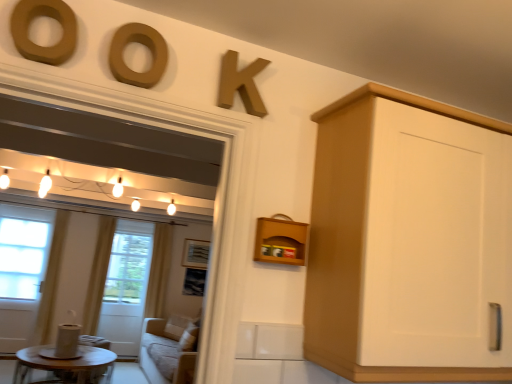
Describe the element at coordinates (126, 286) in the screenshot. I see `white glass screen door at left` at that location.

This screenshot has width=512, height=384. What do you see at coordinates (196, 253) in the screenshot? I see `wooden picture frame at center` at bounding box center [196, 253].

Image resolution: width=512 pixels, height=384 pixels. What are the coordinates of `wooden picture frame at center` in the screenshot? It's located at (196, 253).

Locate an element on the screen. The image size is (512, 384). wooden shelf at center is located at coordinates (280, 241).

What do you see at coordinates (50, 279) in the screenshot? Image resolution: width=512 pixels, height=384 pixels. I see `white fabric curtain at left, acting as the 3th curtain starting from the right` at bounding box center [50, 279].

This screenshot has height=384, width=512. I want to click on white matte cabinet at right, so click(410, 242).

In the scene shown: How different are the orientations of white matte cabinet at right and wooden round table at lower left in degrees?

The facing directions of white matte cabinet at right and wooden round table at lower left are 0.341 degrees apart.

Does white matte cabinet at right have a lesser width compared to wooden round table at lower left?

Indeed, white matte cabinet at right has a lesser width compared to wooden round table at lower left.

In the image, is white matte cabinet at right positioned in front of or behind wooden round table at lower left?

Clearly, white matte cabinet at right is in front of wooden round table at lower left.

Is white matte cabinet at right facing away from wooden round table at lower left?

Yes, white matte cabinet at right is facing away from wooden round table at lower left.

In the scene shown: Is matte gold letter k at upper center to the left or to the right of wooden picture frame at center in the image?

From the image, it's evident that matte gold letter k at upper center is to the right of wooden picture frame at center.

Is matte gold letter k at upper center oriented away from wooden picture frame at center?

Yes, matte gold letter k at upper center is facing away from wooden picture frame at center.

What's the angular difference between matte gold letter k at upper center and wooden picture frame at center's facing directions?

The angular difference between matte gold letter k at upper center and wooden picture frame at center is 1.93 degrees.

From the image's perspective, is matte gold letter k at upper center beneath wooden picture frame at center?

No, from the image's perspective, matte gold letter k at upper center is not below wooden picture frame at center.

From the image's perspective, is white sheer curtain at left, which is the 2th curtain in left-to-right order, beneath yellow fabric curtain at left, the first curtain positioned from the right?

Actually, white sheer curtain at left, which is the 2th curtain in left-to-right order, appears above yellow fabric curtain at left, the first curtain positioned from the right, in the image.

Is point (111, 228) positioned in front of point (170, 229)?

That is True.

Does white sheer curtain at left, which is the 2th curtain in left-to-right order, have a larger size compared to yellow fabric curtain at left, the first curtain positioned from the right?

Incorrect, white sheer curtain at left, which is the 2th curtain in left-to-right order, is not larger than yellow fabric curtain at left, the first curtain positioned from the right.

Choose the correct answer: Is white sheer curtain at left, the second curtain positioned from the right, inside yellow fabric curtain at left, the first curtain positioned from the right, or outside it?

white sheer curtain at left, the second curtain positioned from the right, is not inside yellow fabric curtain at left, the first curtain positioned from the right, it's outside.

In the scene shown: Does white wood door at left have a lesser width compared to matte gold letter k at upper center?

No, white wood door at left is not thinner than matte gold letter k at upper center.

How different are the orientations of white wood door at left and matte gold letter k at upper center in degrees?

There is a 1.56-degree angle between the facing directions of white wood door at left and matte gold letter k at upper center.

Is white wood door at left positioned far away from matte gold letter k at upper center?

Yes.

Is white wood door at left completely or partially outside of matte gold letter k at upper center?

Yes, white wood door at left is outside of matte gold letter k at upper center.

Considering the points (199, 247) and (251, 70), which point is in front, point (199, 247) or point (251, 70)?

The point (251, 70) is closer to the camera.

Between wooden picture frame at center and matte gold letter k at upper center, which one has smaller width?

wooden picture frame at center is thinner.

Are wooden picture frame at center and matte gold letter k at upper center far apart?

Indeed, wooden picture frame at center is not near matte gold letter k at upper center.

I want to click on screen door in front of the yellow fabric curtain at left, the first curtain positioned from the right, so click(126, 286).

Which object is wider, yellow fabric curtain at left, the third curtain viewed from the left, or white glass screen door at left?

white glass screen door at left.

Is yellow fabric curtain at left, the first curtain positioned from the right, positioned far away from white glass screen door at left?

yellow fabric curtain at left, the first curtain positioned from the right, is actually quite close to white glass screen door at left.

Based on the photo, from a real-world perspective, who is located lower, yellow fabric curtain at left, the third curtain viewed from the left, or white glass screen door at left?

white glass screen door at left is physically lower.

Is yellow fabric curtain at left, the third curtain viewed from the left, closer to the viewer compared to matte wood letter at upper center, the second oval from the left?

No, it is not.

Is yellow fabric curtain at left, the first curtain positioned from the right, spatially inside matte wood letter at upper center, positioned as the 1th oval in right-to-left order, or outside of it?

The correct answer is: outside.

Identify the location of cabinetry that is above the wooden round table at lower left (from a real-world perspective). coord(410,242).

Identify the location of number in front of the wooden picture frame at center. The height and width of the screenshot is (384, 512). (241, 84).

Estimate the real-world distances between objects in this image. Which object is further from matte gold letter k at upper center, white fabric curtain at left, positioned as the first curtain in left-to-right order, or wooden round table at lower left?

Among the two, white fabric curtain at left, positioned as the first curtain in left-to-right order, is located further to matte gold letter k at upper center.

From the image, which object appears to be nearer to wooden picture frame at center, white sheer curtain at left, which is the 2th curtain in left-to-right order, or matte gold letter k at upper center?

The object closer to wooden picture frame at center is white sheer curtain at left, which is the 2th curtain in left-to-right order.

Looking at the image, which one is located closer to white sheer curtain at left, the second curtain positioned from the right, wooden round table at lower left or matte wood letter at upper center, the second oval from the left?

wooden round table at lower left.

From the image, which object appears to be farther from wooden round table at lower left, matte brown letter o at upper left, which appears as the 2th oval when viewed from the right, or white fabric curtain at left, positioned as the first curtain in left-to-right order?

The object further to wooden round table at lower left is matte brown letter o at upper left, which appears as the 2th oval when viewed from the right.

When comparing their distances from yellow fabric curtain at left, the first curtain positioned from the right, does white matte cabinet at right or wooden round table at lower left seem closer?

wooden round table at lower left lies closer to yellow fabric curtain at left, the first curtain positioned from the right, than the other object.

From the picture: From the image, which object appears to be farther from white matte cabinet at right, matte brown letter o at upper left, which appears as the 2th oval when viewed from the right, or matte wood letter at upper center, positioned as the 1th oval in right-to-left order?

matte brown letter o at upper left, which appears as the 2th oval when viewed from the right.

Considering their positions, is white fabric curtain at left, positioned as the first curtain in left-to-right order, positioned closer to wooden shelf at center than white glass screen door at left?

white fabric curtain at left, positioned as the first curtain in left-to-right order, is positioned closer to the anchor wooden shelf at center.

When comparing their distances from white fabric curtain at left, acting as the 3th curtain starting from the right, does wooden shelf at center or yellow fabric curtain at left, the third curtain viewed from the left, seem further?

Based on the image, wooden shelf at center appears to be further to white fabric curtain at left, acting as the 3th curtain starting from the right.

This screenshot has width=512, height=384. Identify the location of curtain located between white wood door at left and white sheer curtain at left, which is the 2th curtain in left-to-right order, in the left-right direction. (50, 279).

Find the location of a particular element. This screenshot has width=512, height=384. number between white matte cabinet at right and wooden round table at lower left along the z-axis is located at coordinates tap(241, 84).

In order to click on screen door located between wooden shelf at center and yellow fabric curtain at left, the first curtain positioned from the right, in the depth direction in this screenshot , I will do `click(126, 286)`.

Where is `shelf between matte gold letter k at upper center and white fabric curtain at left, acting as the 3th curtain starting from the right, along the z-axis`? This screenshot has width=512, height=384. shelf between matte gold letter k at upper center and white fabric curtain at left, acting as the 3th curtain starting from the right, along the z-axis is located at coordinates (280, 241).